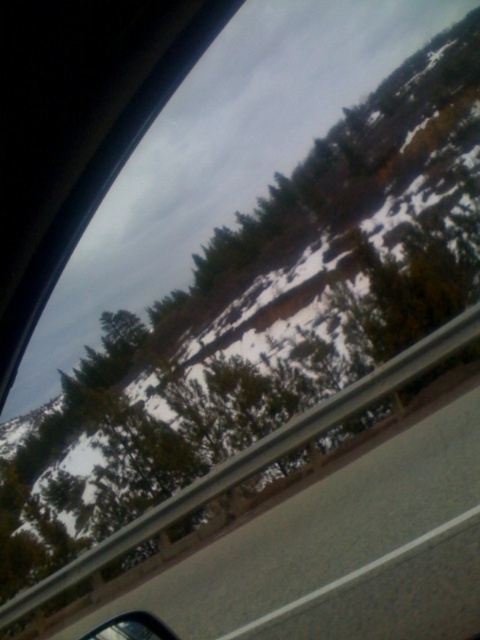
Question: Which of the following is the closest to the observer?

Choices:
 (A) (135, 630)
 (B) (96, 595)

Answer: (A)

Question: Is gray concrete highway at lower center to the right of glossy metallic car mirror at lower left from the viewer's perspective?

Choices:
 (A) yes
 (B) no

Answer: (B)

Question: Which point is closer to the camera?

Choices:
 (A) glossy metallic car mirror at lower left
 (B) gray concrete highway at lower center

Answer: (A)

Question: Can you confirm if gray concrete highway at lower center is wider than glossy metallic car mirror at lower left?

Choices:
 (A) no
 (B) yes

Answer: (A)

Question: Is gray concrete highway at lower center further to the viewer compared to glossy metallic car mirror at lower left?

Choices:
 (A) yes
 (B) no

Answer: (A)